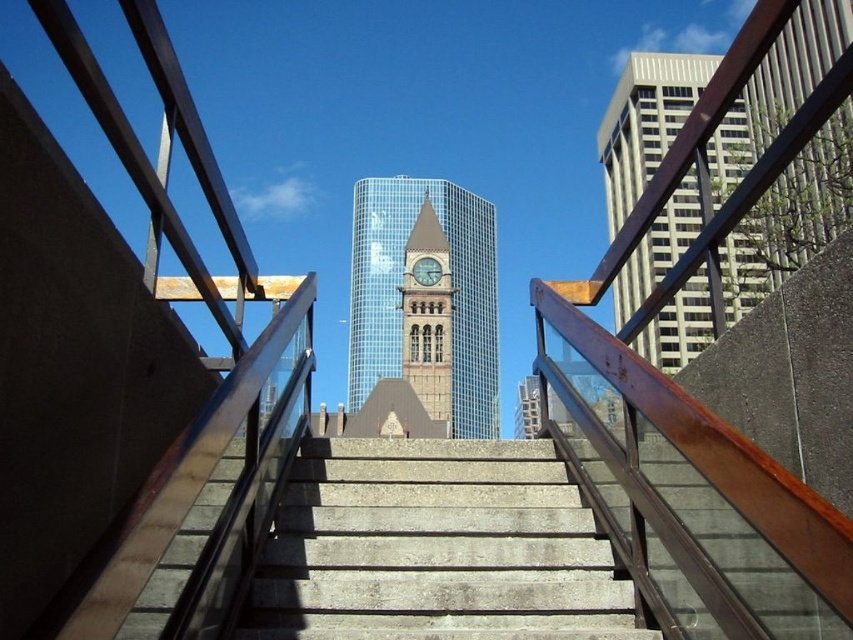
You are standing at the top of the staircase and want to take a photo of the smooth gray skyscraper at right. The camera you have can focus on objects up to 30 meters away. Will the skyscraper be in focus?

The smooth gray skyscraper at right is 30.57 meters away from the camera. Since the camera can only focus up to 30 meters, the skyscraper is slightly out of the camera range and will not be in focus.

Consider the image. You are standing at the top of the staircase looking down at the city. There are two points marked on the scene, point 1 at coordinates point (668, 362) and point 2 at coordinates point (444, 308). Which point is closer to you?

Point (668, 362) is closer to the camera than point (444, 308).

You are an architect analyzing the cityscape from the staircase. You notice the glassy steel clock tower at center and the gold textured clock at center. Which object occupies more visual space in the scene?

The glassy steel clock tower at center is larger in size than the gold textured clock at center, so it occupies more visual space in the scene.